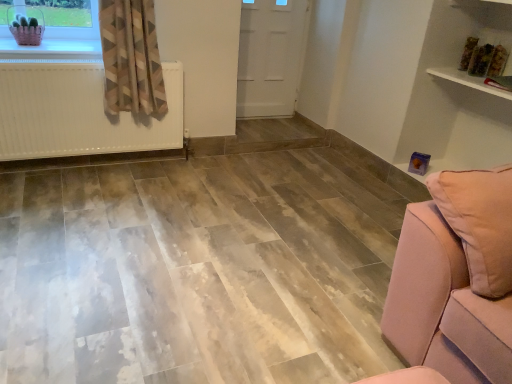
Question: From a real-world perspective, is white glossy shelf at upper right located beneath matte plastic basket at upper left?

Choices:
 (A) yes
 (B) no

Answer: (B)

Question: Is white glossy shelf at upper right positioned with its back to matte plastic basket at upper left?

Choices:
 (A) yes
 (B) no

Answer: (B)

Question: Considering the relative positions of white glossy shelf at upper right and matte plastic basket at upper left in the image provided, is white glossy shelf at upper right to the right of matte plastic basket at upper left from the viewer's perspective?

Choices:
 (A) no
 (B) yes

Answer: (B)

Question: Is white glossy shelf at upper right taller than matte plastic basket at upper left?

Choices:
 (A) no
 (B) yes

Answer: (A)

Question: From a real-world perspective, does white glossy shelf at upper right stand above matte plastic basket at upper left?

Choices:
 (A) no
 (B) yes

Answer: (B)

Question: Is white glossy shelf at upper right not inside matte plastic basket at upper left?

Choices:
 (A) yes
 (B) no

Answer: (A)

Question: From a real-world perspective, does white matte radiator at left sit lower than geometric-patterned fabric curtain at left?

Choices:
 (A) no
 (B) yes

Answer: (B)

Question: From the image's perspective, would you say white matte radiator at left is positioned over geometric-patterned fabric curtain at left?

Choices:
 (A) yes
 (B) no

Answer: (B)

Question: From the image's perspective, does white matte radiator at left appear lower than geometric-patterned fabric curtain at left?

Choices:
 (A) no
 (B) yes

Answer: (B)

Question: Is white matte radiator at left to the left of geometric-patterned fabric curtain at left from the viewer's perspective?

Choices:
 (A) no
 (B) yes

Answer: (B)

Question: Is white matte radiator at left turned away from geometric-patterned fabric curtain at left?

Choices:
 (A) yes
 (B) no

Answer: (B)

Question: From a real-world perspective, is white matte radiator at left on geometric-patterned fabric curtain at left?

Choices:
 (A) no
 (B) yes

Answer: (A)

Question: From a real-world perspective, is matte plastic basket at upper left on top of white glossy shelf at upper right?

Choices:
 (A) yes
 (B) no

Answer: (B)